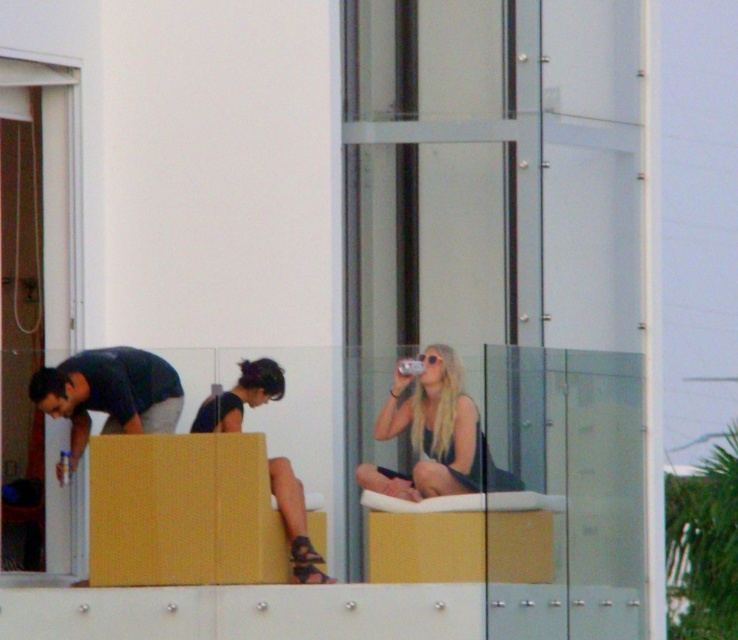
You are standing on the balcony and want to pick up the matte black sandals at center. To do so, do you need to move the matte black shirt at left first?

The matte black shirt at left is above the matte black sandals at center, so you need to move the matte black shirt at left first to access the matte black sandals at center.

What is the significance of the point marked at coordinates (434, 433) in the image?

The point marked at coordinates (434, 433) indicates the location of the blonde hair at center in the image.